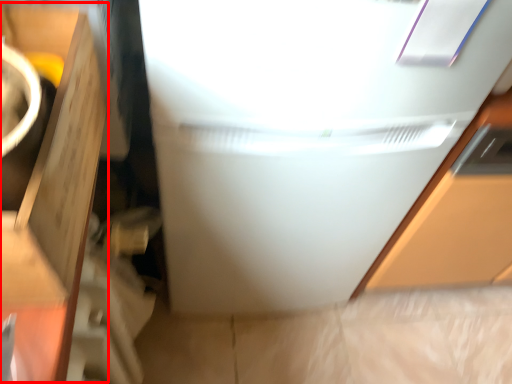
Question: Considering the relative positions of cardboard box (annotated by the red box) and refrigerator in the image provided, where is cardboard box (annotated by the red box) located with respect to the staircase?

Choices:
 (A) right
 (B) left

Answer: (B)